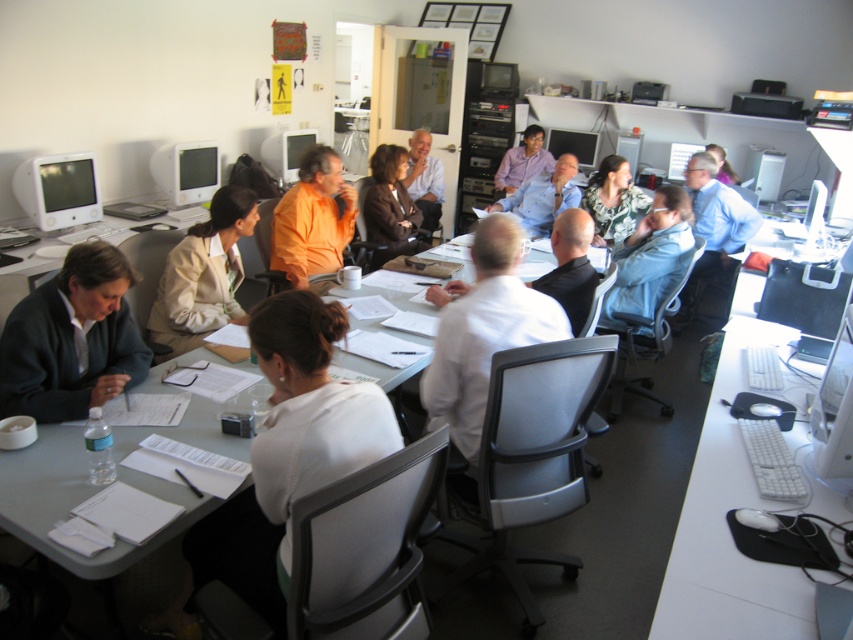
You are a security guard standing at the entrance of the conference room. You need to check if there is enough space between the camouflage fabric shirt at center and the matte black hair at upper right to walk through. The width of your body is 0.5 meters. Can you pass between them?

The camouflage fabric shirt at center is 1.23 meters away from matte black hair at upper right. Since your body width is 0.5 meters, you can easily pass between them as the distance is sufficient.

You are standing at the entrance of the meeting room and want to place a new coffee mug on the white plastic table at right. Based on its location, can you estimate whether the table is near the wall or in the center of the room?

The white plastic table at right is located at point (727,528), which suggests it is positioned closer to the right wall of the room rather than the center. Therefore, the table is likely near the wall.

You are standing in front of the conference table and want to reach both the point at coordinates point (756,320) and point (579,131). Which point should you reach for first if you want to touch the one closer to you?

You should reach for point (756,320) first because it is closer to you than point (579,131).